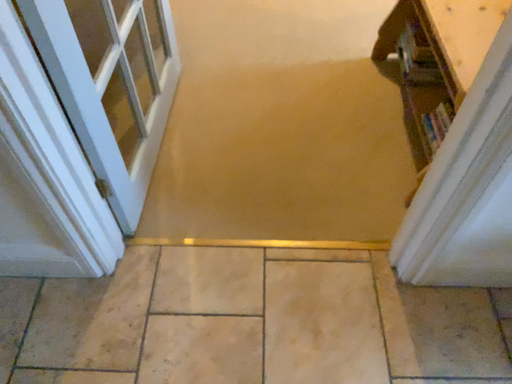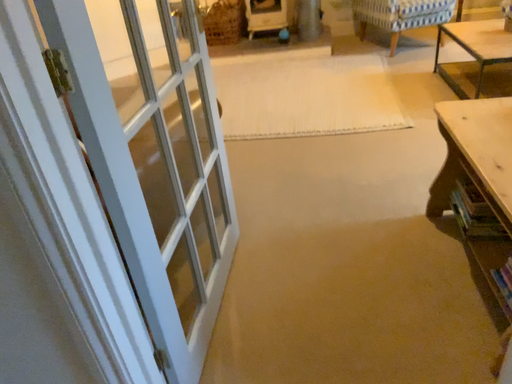
Question: How did the camera likely rotate when shooting the video?

Choices:
 (A) rotated left
 (B) rotated right

Answer: (A)